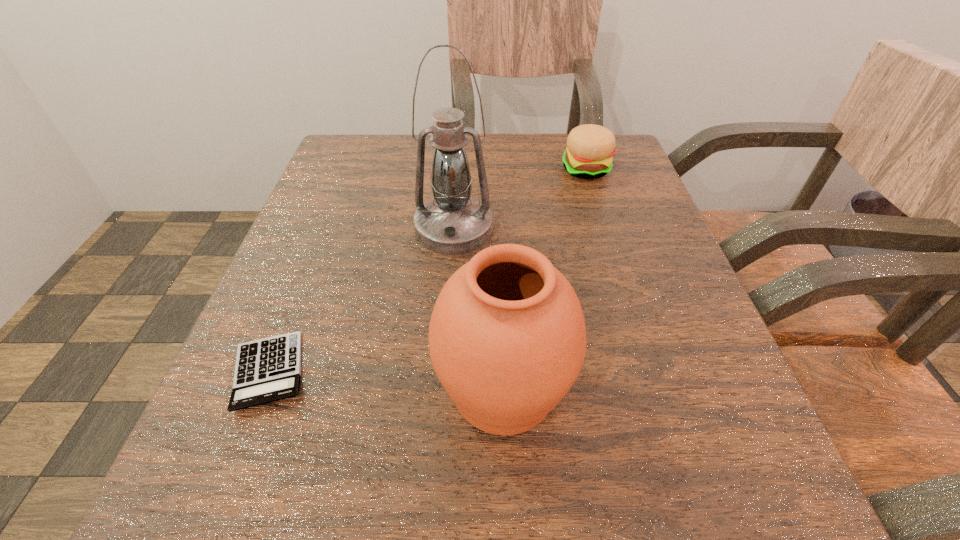
The image size is (960, 540). In the image, there is a desktop. What are the coordinates of `vacant space at the far left corner` in the screenshot? It's located at (376, 164).

Image resolution: width=960 pixels, height=540 pixels. Find the location of `vacant position at the far right corner of the desktop`. vacant position at the far right corner of the desktop is located at coordinates (619, 153).

What are the coordinates of `vacant area between the second shortest object and the calculator` in the screenshot? It's located at (427, 271).

Where is `vacant point located between the urn and the leftmost object`? The height and width of the screenshot is (540, 960). vacant point located between the urn and the leftmost object is located at coordinates (386, 381).

Identify the location of free space between the third shortest object and the calculator. (386, 381).

I want to click on blank region between the rightmost object and the second farthest object, so click(520, 199).

This screenshot has width=960, height=540. In order to click on empty location between the tallest object and the hamburger in this screenshot , I will do `click(520, 199)`.

The width and height of the screenshot is (960, 540). Identify the location of the second closest object to the leftmost object. (452, 223).

Locate an element on the screen. object that can be found as the closest to the third nearest object is located at coordinates (590, 147).

Locate an element on the screen. The width and height of the screenshot is (960, 540). free space that satisfies the following two spatial constraints: 1. on the front side of the urn; 2. on the right side of the tallest object is located at coordinates (444, 389).